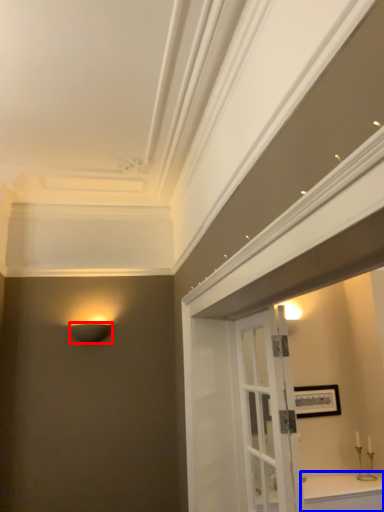
Question: Among these objects, which one is farthest to the camera, lamp (highlighted by a red box) or cabinetry (highlighted by a blue box)?

Choices:
 (A) lamp
 (B) cabinetry

Answer: (A)